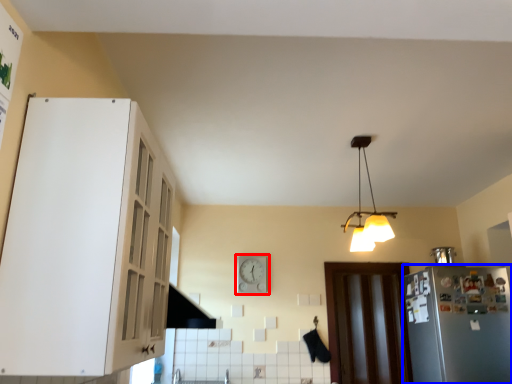
Question: Among these objects, which one is farthest to the camera, clock (highlighted by a red box) or refrigerator (highlighted by a blue box)?

Choices:
 (A) clock
 (B) refrigerator

Answer: (A)